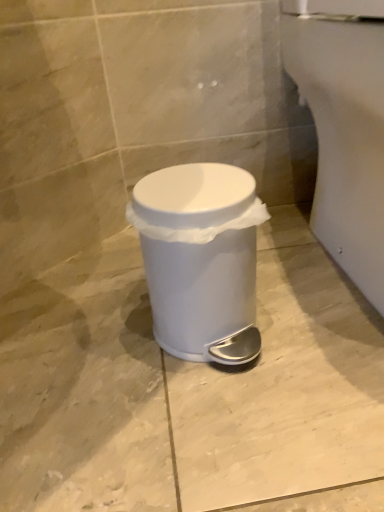
Question: Visually, is white glossy porcelain at lower right positioned to the left or to the right of white plastic waste container at center?

Choices:
 (A) left
 (B) right

Answer: (B)

Question: From the image's perspective, is white glossy porcelain at lower right above or below white plastic waste container at center?

Choices:
 (A) below
 (B) above

Answer: (B)

Question: Which is correct: white glossy porcelain at lower right is inside white plastic waste container at center, or outside of it?

Choices:
 (A) outside
 (B) inside

Answer: (A)

Question: From the image's perspective, is white plastic waste container at center located above or below white glossy porcelain at lower right?

Choices:
 (A) below
 (B) above

Answer: (A)

Question: In the image, is white plastic waste container at center positioned in front of or behind white glossy porcelain at lower right?

Choices:
 (A) behind
 (B) front

Answer: (A)

Question: Visually, is white plastic waste container at center positioned to the left or to the right of white glossy porcelain at lower right?

Choices:
 (A) left
 (B) right

Answer: (A)

Question: In terms of width, does white plastic waste container at center look wider or thinner when compared to white glossy porcelain at lower right?

Choices:
 (A) wide
 (B) thin

Answer: (B)